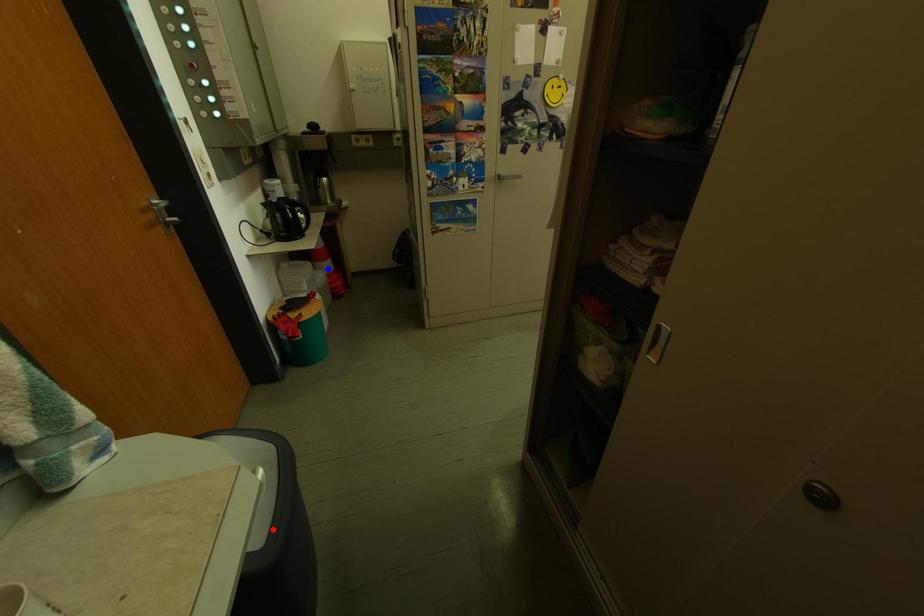
Question: Which of the two points in the image is closer to the camera?

Choices:
 (A) Blue point is closer.
 (B) Red point is closer.

Answer: (B)